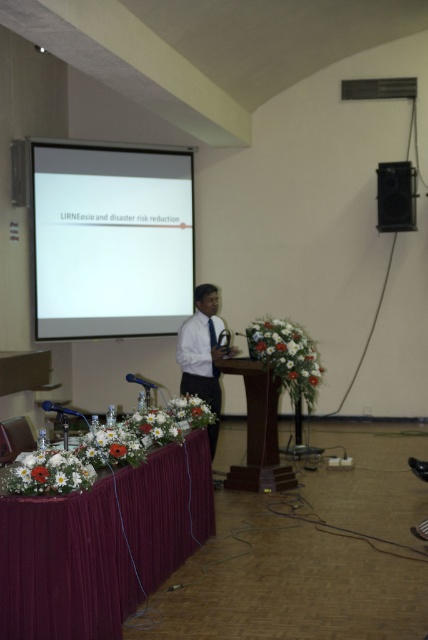
You are organizing a conference and need to place a new decorative item on the table. The wooden at center and the black matte speaker at upper right are already there. Which object should you place the new item next to if you want it to be closer to the larger object?

The wooden at center is bigger than the black matte speaker at upper right, so you should place the new item next to the wooden at center to be closer to the larger object.

You are sitting in the audience and want to know which of the two points, point (85, 332) or point (187, 344), is closer to you. Based on the scene, can you determine this?

Point (85, 332) is closer to you because it is further to the viewer than point (187, 344).

You are organizing a conference and need to place a large decorative centerpiece on the table. Based on the scene, which object, the velvet burgundy tablecloth at lower left or the wooden at center, would be more suitable for placing a large centerpiece?

The velvet burgundy tablecloth at lower left has a larger size compared to wooden at center, so it would be more suitable for placing a large decorative centerpiece.